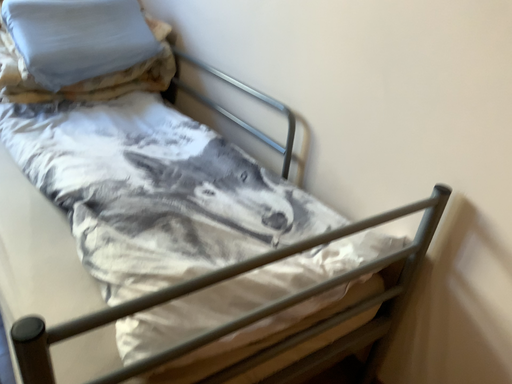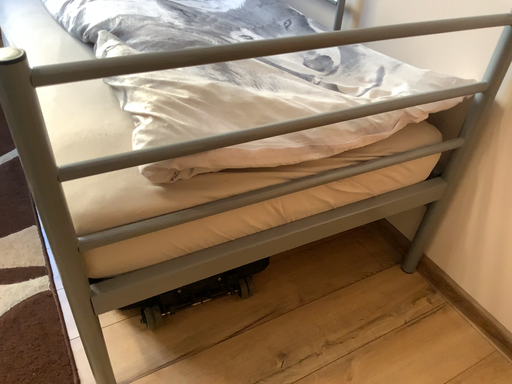
Question: Which way did the camera rotate in the video?

Choices:
 (A) rotated upward
 (B) rotated downward

Answer: (B)